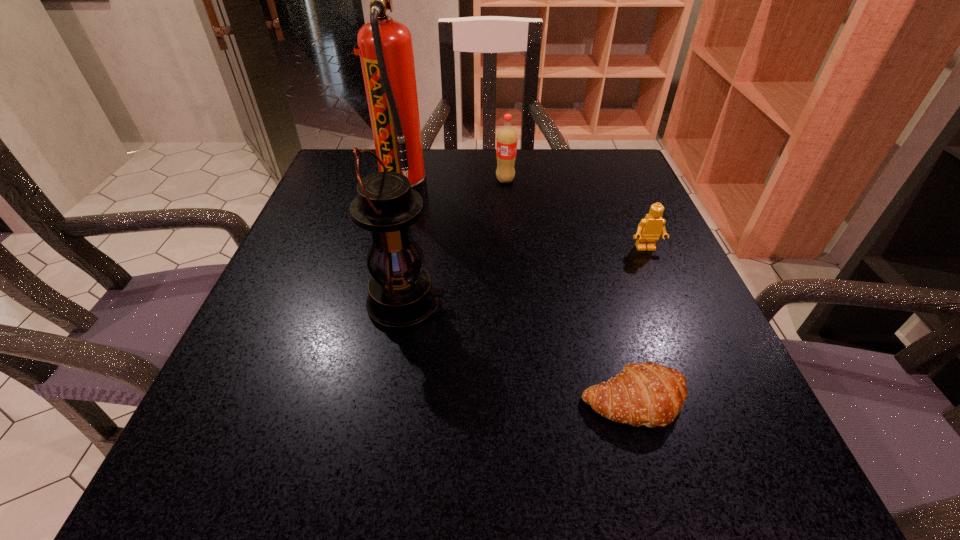
Locate several points within the vacant space situated above the lantern, indicating its light source. Please provide its 2D coordinates. Your answer should be formatted as a tuple, i.e. [(x, y)], where the tuple contains the x and y coordinates of a point satisfying the conditions above.

[(565, 305)]

Locate an element on the screen. vacant area situated on the front of the third object from left to right is located at coordinates pyautogui.click(x=509, y=225).

I want to click on free spot located 0.280m on the face of the Lego, so click(x=703, y=381).

At what (x,y) coordinates should I click in order to perform the action: click on vacant space situated 0.400m on the back of the crescent roll. Please return your answer as a coordinate pair (x, y). Image resolution: width=960 pixels, height=540 pixels. Looking at the image, I should click on (581, 214).

Where is `fire extinguisher that is positioned at the far edge`? This screenshot has height=540, width=960. fire extinguisher that is positioned at the far edge is located at coordinates (385, 47).

Identify the location of soda situated at the far edge. The width and height of the screenshot is (960, 540). (506, 142).

The height and width of the screenshot is (540, 960). What are the coordinates of `object that is at the left edge` in the screenshot? It's located at (385, 47).

At what (x,y) coordinates should I click in order to perform the action: click on Lego present at the right edge. Please return your answer as a coordinate pair (x, y). The height and width of the screenshot is (540, 960). Looking at the image, I should click on (650, 228).

I want to click on crescent roll situated at the right edge, so click(648, 394).

I want to click on object that is at the far left corner, so click(x=385, y=47).